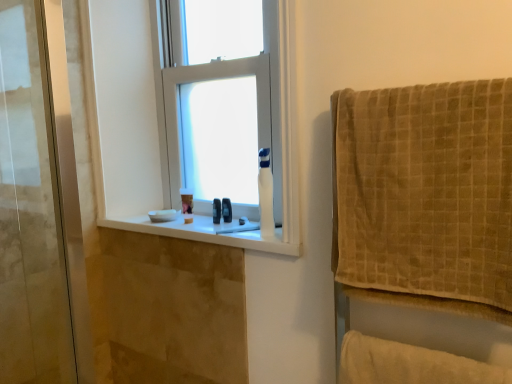
Question: Considering their positions, is beige textured towel at right located in front of or behind white plastic window at center?

Choices:
 (A) behind
 (B) front

Answer: (B)

Question: Is point (428, 210) positioned closer to the camera than point (246, 190)?

Choices:
 (A) farther
 (B) closer

Answer: (B)

Question: Which is nearer to the white glossy window sill at center?

Choices:
 (A) black rubber ring at window
 (B) beige soft towel at lower right
 (C) beige textured towel at right
 (D) white glossy toilet paper at center
 (E) white plastic window at center

Answer: (D)

Question: Which object is the farthest from the white plastic window at center?

Choices:
 (A) beige textured towel at right
 (B) beige soft towel at lower right
 (C) white glossy window sill at center
 (D) black rubber ring at window
 (E) white glossy toilet paper at center

Answer: (B)